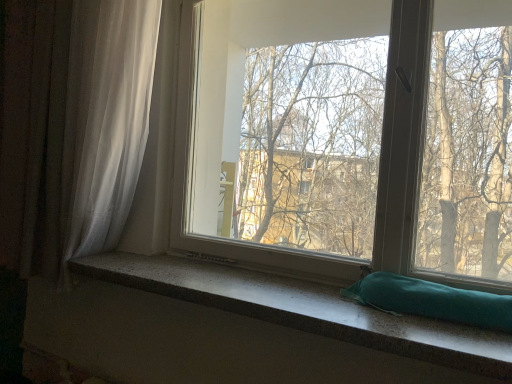
This screenshot has height=384, width=512. Find the location of `free region under transparent glass window at center (from a real-world perspective)`. free region under transparent glass window at center (from a real-world perspective) is located at coordinates (262, 275).